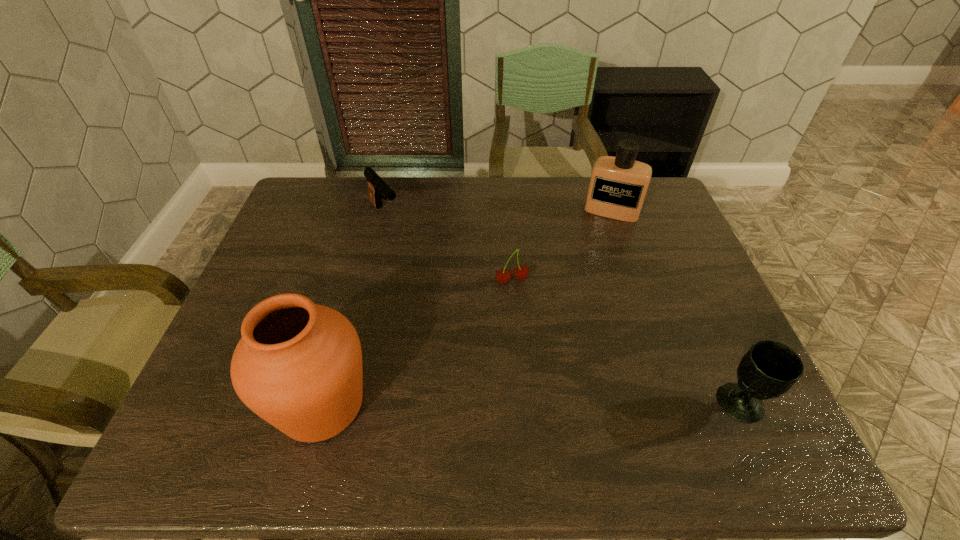
Locate an element on the screen. The width and height of the screenshot is (960, 540). blank area located 0.330m on the surface of the cherry is located at coordinates (555, 396).

You are a GUI agent. You are given a task and a screenshot of the screen. Output one action in this format:
    pyautogui.click(x=<x>, y=<y>)
    Task: Click on the free region located on the front label of the perfume
    The width and height of the screenshot is (960, 540).
    Given the screenshot: What is the action you would take?
    (x=589, y=275)

The height and width of the screenshot is (540, 960). What are the coordinates of `free space located on the front label of the perfume` in the screenshot? It's located at (x=591, y=270).

I want to click on free spot located on the front label of the perfume, so click(x=600, y=241).

I want to click on free space located at the barrel of the fourth tallest object, so click(x=455, y=293).

At what (x,y) coordinates should I click in order to perform the action: click on vacant space located at the barrel of the fourth tallest object. Please return your answer as a coordinate pair (x, y). This screenshot has width=960, height=540. Looking at the image, I should click on (437, 274).

Locate an element on the screen. The height and width of the screenshot is (540, 960). vacant space located 0.390m at the barrel of the fourth tallest object is located at coordinates (463, 302).

The width and height of the screenshot is (960, 540). Identify the location of perfume at the far edge. (618, 185).

Locate an element on the screen. The height and width of the screenshot is (540, 960). pistol located at the far edge is located at coordinates (377, 186).

Identify the location of urn present at the near edge. The image size is (960, 540). (298, 365).